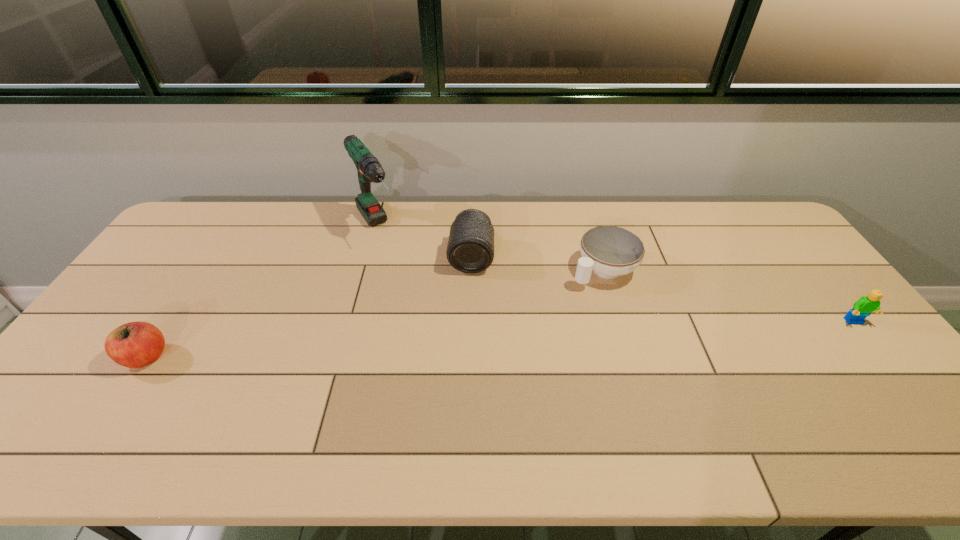
The height and width of the screenshot is (540, 960). Identify the location of blank region between the nearest object and the telephoto lens. (309, 307).

You are a GUI agent. You are given a task and a screenshot of the screen. Output one action in this format:
    pyautogui.click(x=<x>, y=<y>)
    Task: Click on the unoccupied position between the fourth farthest object and the apple
    The width and height of the screenshot is (960, 540).
    Given the screenshot: What is the action you would take?
    pyautogui.click(x=500, y=340)

The height and width of the screenshot is (540, 960). I want to click on empty space between the nearest object and the chinaware, so click(374, 313).

Identify the location of free space that is in between the chinaware and the Lego. This screenshot has height=540, width=960. (729, 296).

At what (x,y) coordinates should I click in order to perform the action: click on free spot between the apple and the Lego. Please return your answer as a coordinate pair (x, y). The height and width of the screenshot is (540, 960). Looking at the image, I should click on (500, 340).

What are the coordinates of `unoccupied area between the fourth shortest object and the leftmost object` in the screenshot? It's located at (309, 307).

Find the location of a particular element. vacant area that lies between the second nearest object and the fourth object from left to right is located at coordinates (729, 296).

You are a GUI agent. You are given a task and a screenshot of the screen. Output one action in this format:
    pyautogui.click(x=<x>, y=<y>)
    Task: Click on the free spot between the chinaware and the telephoto lens
    
    Given the screenshot: What is the action you would take?
    pyautogui.click(x=538, y=264)

Where is `vacant space in between the leftmost object and the chinaware`? The image size is (960, 540). vacant space in between the leftmost object and the chinaware is located at coordinates (374, 313).

Identify the location of the second closest object to the drill. (137, 344).